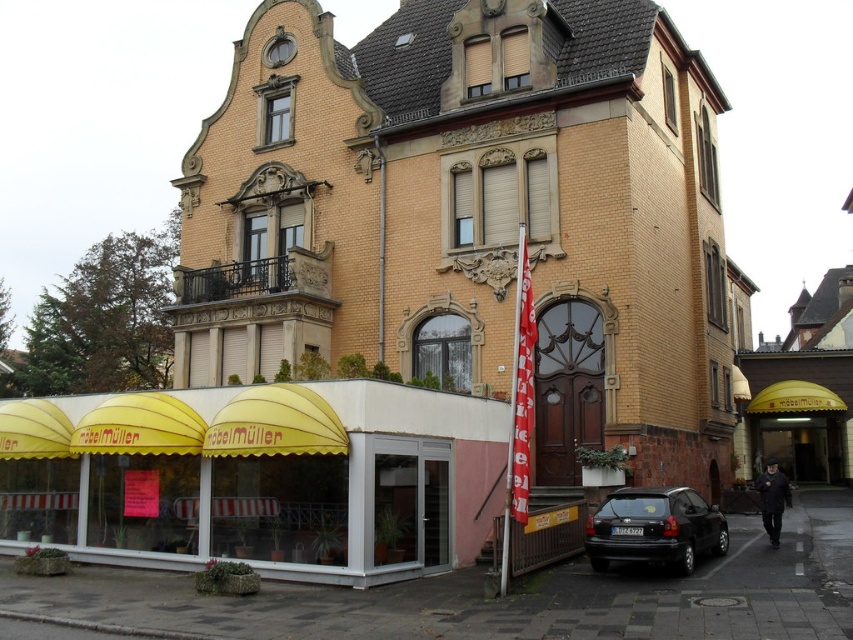
Is yellow fabric awning at lower left in front of black matte hatchback at lower right?

No, it is not.

Is yellow fabric awning at lower left thinner than black matte hatchback at lower right?

In fact, yellow fabric awning at lower left might be wider than black matte hatchback at lower right.

I want to click on yellow fabric awning at lower left, so point(257,476).

How far apart are yellow brick building at center and yellow fabric awning at lower left?

yellow brick building at center is 15.23 meters away from yellow fabric awning at lower left.

Does yellow brick building at center have a greater width compared to yellow fabric awning at lower left?

Indeed, yellow brick building at center has a greater width compared to yellow fabric awning at lower left.

Is point (332, 68) farther from camera compared to point (167, 433)?

Yes, it is.

The width and height of the screenshot is (853, 640). Find the location of `yellow brick building at center`. yellow brick building at center is located at coordinates (473, 218).

Can you confirm if yellow brick building at center is positioned to the right of yellow fabric canopy at center?

In fact, yellow brick building at center is to the left of yellow fabric canopy at center.

Between point (724, 378) and point (805, 404), which one is positioned behind?

Positioned behind is point (805, 404).

Does point (573, 406) come closer to viewer compared to point (780, 400)?

Yes, it is.

This screenshot has height=640, width=853. I want to click on yellow brick building at center, so click(473, 218).